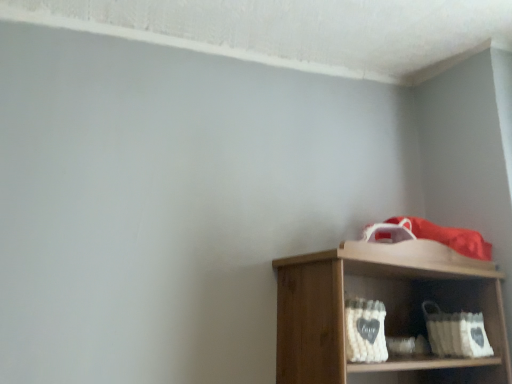
Locate an element on the screen. The height and width of the screenshot is (384, 512). white woven basket at lower center, the first basket positioned from the front is located at coordinates (365, 330).

What do you see at coordinates (365, 330) in the screenshot?
I see `white woven basket at lower center, the first basket positioned from the front` at bounding box center [365, 330].

What do you see at coordinates (456, 333) in the screenshot?
I see `white fabric basket at lower right, positioned as the first basket in back-to-front order` at bounding box center [456, 333].

Image resolution: width=512 pixels, height=384 pixels. Identify the location of white fabric basket at lower right, which is the second basket in left-to-right order. (456, 333).

This screenshot has height=384, width=512. What are the coordinates of `white woven basket at lower center, the first basket in the left-to-right sequence` in the screenshot? It's located at (365, 330).

Is white woven basket at lower center, which is counted as the 2th basket, starting from the right, to the left of white fabric basket at lower right, positioned as the first basket in back-to-front order, from the viewer's perspective?

Indeed, white woven basket at lower center, which is counted as the 2th basket, starting from the right, is positioned on the left side of white fabric basket at lower right, positioned as the first basket in back-to-front order.

Which object is more forward, white woven basket at lower center, the first basket in the left-to-right sequence, or white fabric basket at lower right, the 2th basket from the front?

white woven basket at lower center, the first basket in the left-to-right sequence, is closer to the camera.

Between point (372, 357) and point (444, 352), which one is positioned in front?

The point (372, 357) is in front.

From the image's perspective, which one is positioned lower, white woven basket at lower center, the 2th basket when ordered from back to front, or white fabric basket at lower right, the 2th basket from the front?

white fabric basket at lower right, the 2th basket from the front, from the image's perspective.

From a real-world perspective, is white woven basket at lower center, the 2th basket when ordered from back to front, physically located above or below white fabric basket at lower right, the 2th basket from the front?

Clearly, from a real-world perspective, white woven basket at lower center, the 2th basket when ordered from back to front, is above white fabric basket at lower right, the 2th basket from the front.

Which of these two, white woven basket at lower center, which is counted as the 2th basket, starting from the right, or white fabric basket at lower right, the 2th basket from the front, is thinner?

white woven basket at lower center, which is counted as the 2th basket, starting from the right.

Considering the sizes of objects white woven basket at lower center, the first basket in the left-to-right sequence, and white fabric basket at lower right, the 2th basket from the front, in the image provided, who is shorter, white woven basket at lower center, the first basket in the left-to-right sequence, or white fabric basket at lower right, the 2th basket from the front,?

white woven basket at lower center, the first basket in the left-to-right sequence, is shorter.

Between white woven basket at lower center, which is counted as the 2th basket, starting from the right, and white fabric basket at lower right, positioned as the first basket in back-to-front order, which one has smaller size?

With smaller size is white woven basket at lower center, which is counted as the 2th basket, starting from the right.

Can white fabric basket at lower right, which is the second basket in left-to-right order, be found inside white woven basket at lower center, the 2th basket when ordered from back to front?

No, white fabric basket at lower right, which is the second basket in left-to-right order, is not inside white woven basket at lower center, the 2th basket when ordered from back to front.

Is white woven basket at lower center, the first basket positioned from the front, positioned far away from white fabric basket at lower right, positioned as the first basket in back-to-front order?

No, white woven basket at lower center, the first basket positioned from the front, is not far from white fabric basket at lower right, positioned as the first basket in back-to-front order.

Is white fabric basket at lower right, which is the second basket in left-to-right order, at the back of white woven basket at lower center, the first basket in the left-to-right sequence?

No, white woven basket at lower center, the first basket in the left-to-right sequence, is not facing the opposite direction of white fabric basket at lower right, which is the second basket in left-to-right order.

What's the angular difference between white woven basket at lower center, the first basket in the left-to-right sequence, and white fabric basket at lower right, placed as the 1th basket when sorted from right to left,'s facing directions?

There is a 2.35-degree angle between the facing directions of white woven basket at lower center, the first basket in the left-to-right sequence, and white fabric basket at lower right, placed as the 1th basket when sorted from right to left.

How distant is white woven basket at lower center, the first basket positioned from the front, from white fabric basket at lower right, positioned as the first basket in back-to-front order?

white woven basket at lower center, the first basket positioned from the front, and white fabric basket at lower right, positioned as the first basket in back-to-front order, are 17.00 inches apart.

You are a GUI agent. You are given a task and a screenshot of the screen. Output one action in this format:
    pyautogui.click(x=<x>, y=<y>)
    Task: Click on the basket below the white woven basket at lower center, which is counted as the 2th basket, starting from the right (from the image's perspective)
    The height and width of the screenshot is (384, 512).
    Given the screenshot: What is the action you would take?
    pyautogui.click(x=456, y=333)

Considering the relative positions of white fabric basket at lower right, placed as the 1th basket when sorted from right to left, and white woven basket at lower center, which is counted as the 2th basket, starting from the right, in the image provided, is white fabric basket at lower right, placed as the 1th basket when sorted from right to left, to the left of white woven basket at lower center, which is counted as the 2th basket, starting from the right, from the viewer's perspective?

No, white fabric basket at lower right, placed as the 1th basket when sorted from right to left, is not to the left of white woven basket at lower center, which is counted as the 2th basket, starting from the right.

Is white fabric basket at lower right, placed as the 1th basket when sorted from right to left, positioned before white woven basket at lower center, the 2th basket when ordered from back to front?

No, it is behind white woven basket at lower center, the 2th basket when ordered from back to front.

Between point (437, 355) and point (375, 336), which one is positioned in front?

The point (375, 336) is in front.

From the image's perspective, which one is positioned lower, white fabric basket at lower right, placed as the 1th basket when sorted from right to left, or white woven basket at lower center, the first basket positioned from the front?

white fabric basket at lower right, placed as the 1th basket when sorted from right to left, is shown below in the image.

From a real-world perspective, is white fabric basket at lower right, positioned as the first basket in back-to-front order, physically located above or below white woven basket at lower center, the first basket positioned from the front?

From a real-world perspective, white fabric basket at lower right, positioned as the first basket in back-to-front order, is physically below white woven basket at lower center, the first basket positioned from the front.

Can you confirm if white fabric basket at lower right, which is the second basket in left-to-right order, is wider than white woven basket at lower center, the first basket in the left-to-right sequence?

Correct, the width of white fabric basket at lower right, which is the second basket in left-to-right order, exceeds that of white woven basket at lower center, the first basket in the left-to-right sequence.

Does white fabric basket at lower right, placed as the 1th basket when sorted from right to left, have a greater height compared to white woven basket at lower center, which is counted as the 2th basket, starting from the right?

Correct, white fabric basket at lower right, placed as the 1th basket when sorted from right to left, is much taller as white woven basket at lower center, which is counted as the 2th basket, starting from the right.

Which of these two, white fabric basket at lower right, placed as the 1th basket when sorted from right to left, or white woven basket at lower center, the 2th basket when ordered from back to front, is smaller?

With smaller size is white woven basket at lower center, the 2th basket when ordered from back to front.

Is white woven basket at lower center, which is counted as the 2th basket, starting from the right, completely or partially inside white fabric basket at lower right, which is the second basket in left-to-right order?

No, white woven basket at lower center, which is counted as the 2th basket, starting from the right, is not inside white fabric basket at lower right, which is the second basket in left-to-right order.

Is white fabric basket at lower right, which is the second basket in left-to-right order, far from white woven basket at lower center, the first basket positioned from the front?

No, white fabric basket at lower right, which is the second basket in left-to-right order, is not far from white woven basket at lower center, the first basket positioned from the front.

Is white fabric basket at lower right, the 2th basket from the front, positioned with its back to white woven basket at lower center, the first basket positioned from the front?

No, white fabric basket at lower right, the 2th basket from the front,'s orientation is not away from white woven basket at lower center, the first basket positioned from the front.

Consider the image. How many degrees apart are the facing directions of white fabric basket at lower right, positioned as the first basket in back-to-front order, and white woven basket at lower center, the 2th basket when ordered from back to front?

The facing directions of white fabric basket at lower right, positioned as the first basket in back-to-front order, and white woven basket at lower center, the 2th basket when ordered from back to front, are 2.35 degrees apart.

The image size is (512, 384). Find the location of `basket on the right of the white woven basket at lower center, the first basket in the left-to-right sequence`. basket on the right of the white woven basket at lower center, the first basket in the left-to-right sequence is located at coordinates (456, 333).

At what (x,y) coordinates should I click in order to perform the action: click on basket below the white woven basket at lower center, the first basket positioned from the front (from the image's perspective). Please return your answer as a coordinate pair (x, y). The height and width of the screenshot is (384, 512). Looking at the image, I should click on (456, 333).

The height and width of the screenshot is (384, 512). I want to click on basket that appears below the white woven basket at lower center, the first basket positioned from the front (from a real-world perspective), so click(456, 333).